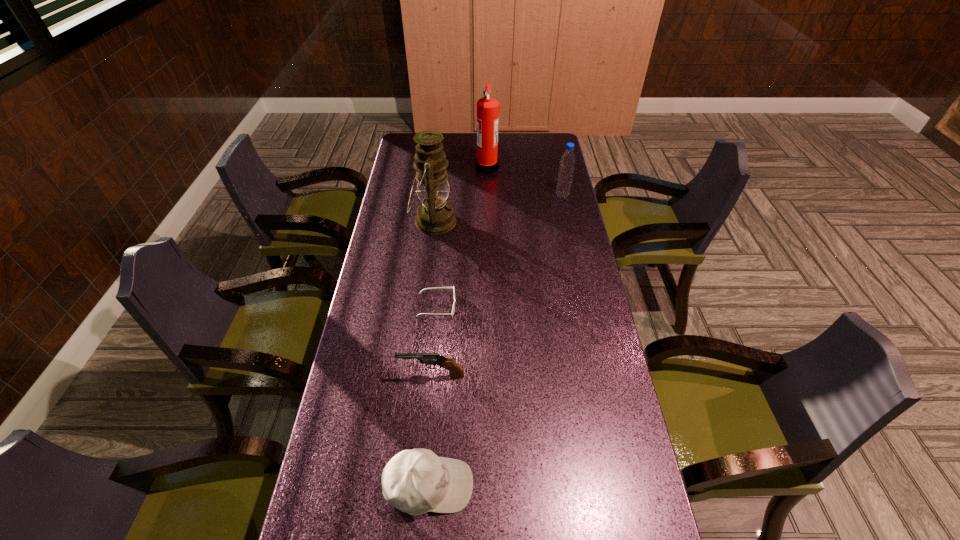
At what (x,y) coordinates should I click in order to perform the action: click on the farthest object. Please return your answer as a coordinate pair (x, y). Looking at the image, I should click on (488, 108).

Where is `the fourth nearest object`? the fourth nearest object is located at coordinates (435, 216).

Identify the location of the third tallest object. (567, 161).

You are a GUI agent. You are given a task and a screenshot of the screen. Output one action in this format:
    pyautogui.click(x=<x>, y=<y>)
    Task: Click on the water bottle
    Image resolution: width=960 pixels, height=540 pixels.
    Given the screenshot: What is the action you would take?
    pyautogui.click(x=567, y=161)

At what (x,y) coordinates should I click in order to perform the action: click on gun. Please return your answer as a coordinate pair (x, y). Looking at the image, I should click on point(456,371).

The width and height of the screenshot is (960, 540). In order to click on the nearest object in this screenshot , I will do `click(417, 481)`.

The width and height of the screenshot is (960, 540). I want to click on sunglasses, so click(453, 308).

I want to click on the shortest object, so click(x=453, y=308).

Identify the location of blank space located with the nozzle aimed from the farthest object. click(x=406, y=167).

Find the location of a particular element. This screenshot has height=540, width=960. vacant space situated with the nozzle aimed from the farthest object is located at coordinates (411, 167).